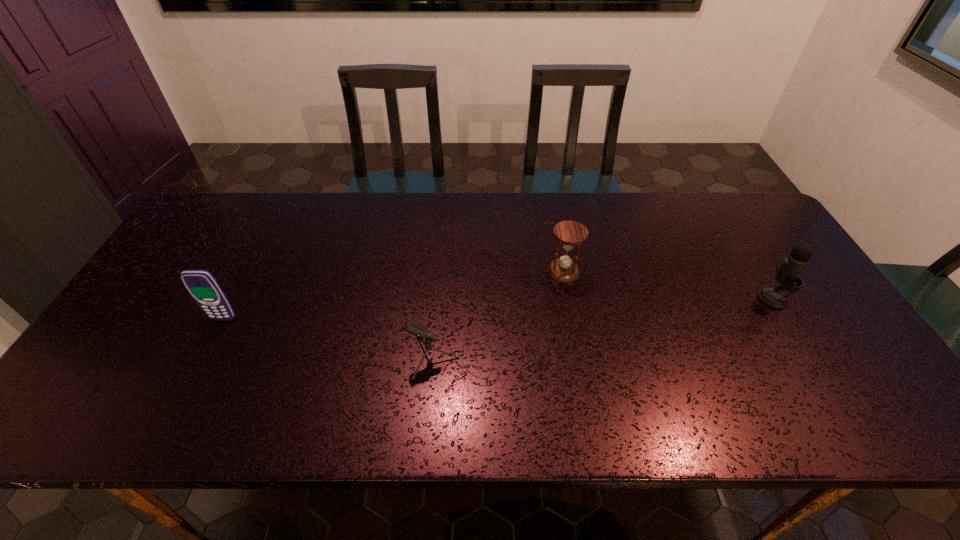
What are the coordinates of `vacant area located on the front of the hourglass` in the screenshot? It's located at (580, 363).

Find the location of a particular element. This screenshot has height=540, width=960. free space located on the stand of the nearest object is located at coordinates (521, 360).

You are a GUI agent. You are given a task and a screenshot of the screen. Output one action in this format:
    pyautogui.click(x=<x>, y=<y>)
    Task: Click on the object that is at the right edge
    
    Given the screenshot: What is the action you would take?
    pyautogui.click(x=798, y=258)

At what (x,y) coordinates should I click in order to perform the action: click on blank space at the far edge of the desktop. Please return your answer as a coordinate pair (x, y). The image size is (960, 540). Looking at the image, I should click on (476, 236).

In the image, there is a desktop. Where is `vacant region at the near edge`? This screenshot has height=540, width=960. vacant region at the near edge is located at coordinates (650, 406).

In the image, there is a desktop. Identify the location of vacant space at the left edge. This screenshot has width=960, height=540. (145, 306).

Identify the location of blank space at the right edge of the desktop. This screenshot has height=540, width=960. (751, 275).

In the image, there is a desktop. Identify the location of free space at the far left corner. Image resolution: width=960 pixels, height=540 pixels. (222, 213).

Locate an element on the screen. The image size is (960, 540). free point at the near left corner is located at coordinates (86, 410).

Locate an element on the screen. Image resolution: width=960 pixels, height=540 pixels. free space at the far right corner of the desktop is located at coordinates (732, 233).